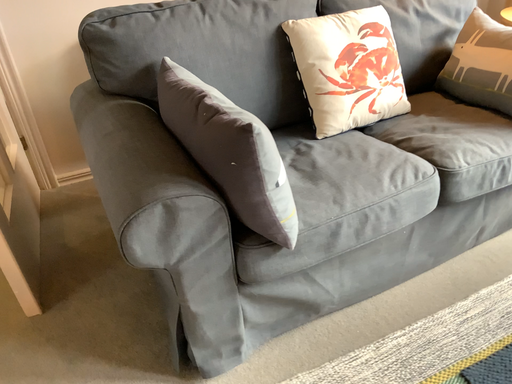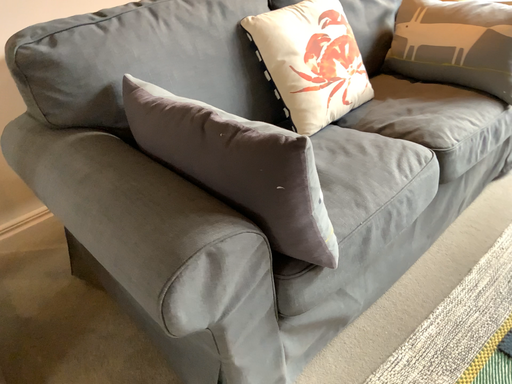
Question: Which way did the camera rotate in the video?

Choices:
 (A) rotated left
 (B) rotated right

Answer: (B)